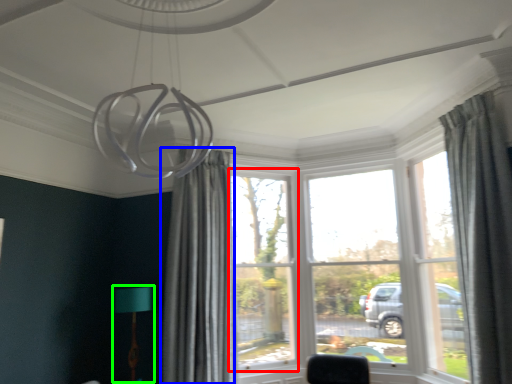
Question: Estimate the real-world distances between objects in this image. Which object is closer to window (highlighted by a red box), curtain (highlighted by a blue box) or table lamp (highlighted by a green box)?

Choices:
 (A) curtain
 (B) table lamp

Answer: (A)